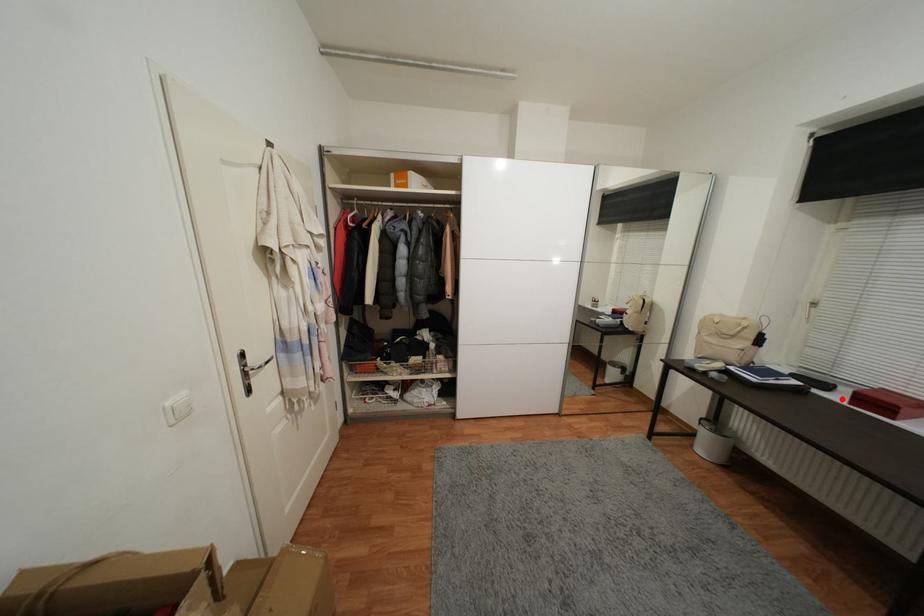
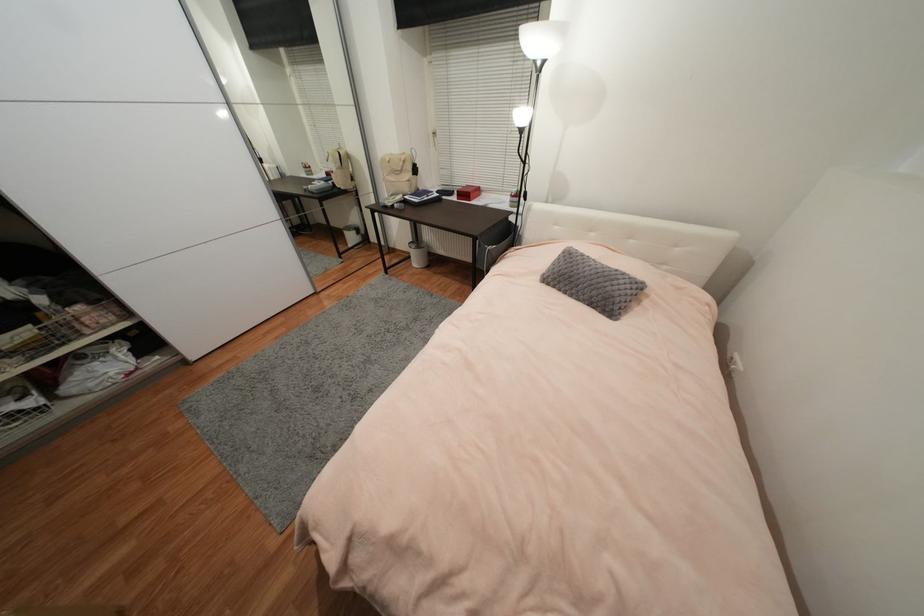
Question: I am providing you with two images of the same scene from different viewpoints. In image1, a red point is highlighted. Considering the same 3D point in image2, which of the following is correct?

Choices:
 (A) It is closer
 (B) It is farther

Answer: (A)